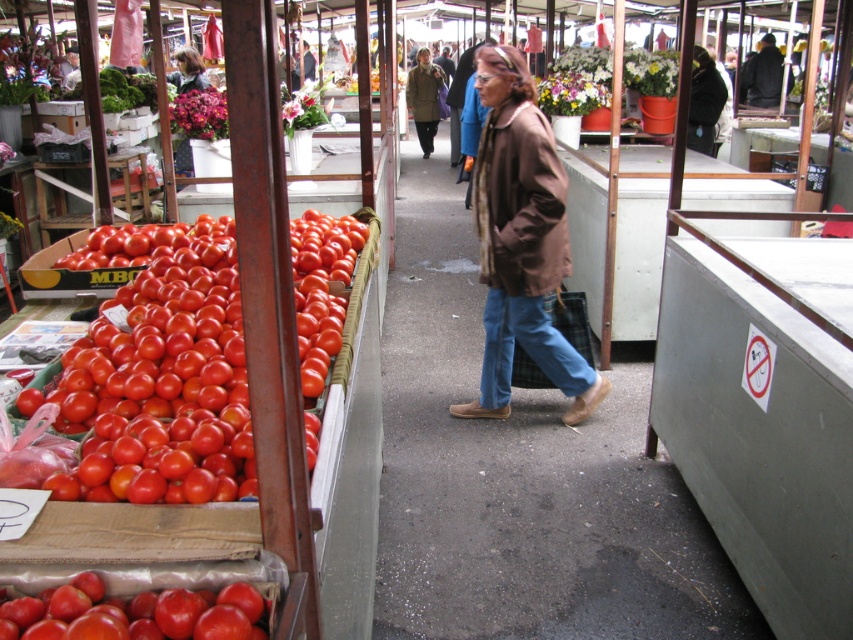
From the picture: You are standing at the center of the market and see the shiny red tomatoes at left. Can you determine their exact location in the scene?

The shiny red tomatoes at left are located at coordinates point (x=158, y=390).

In the market scene, you see the shiny red tomatoes at left and the dark brown leather jacket at upper right. Which object takes up more space in the image?

The dark brown leather jacket at upper right takes up more space in the image than the shiny red tomatoes at left.